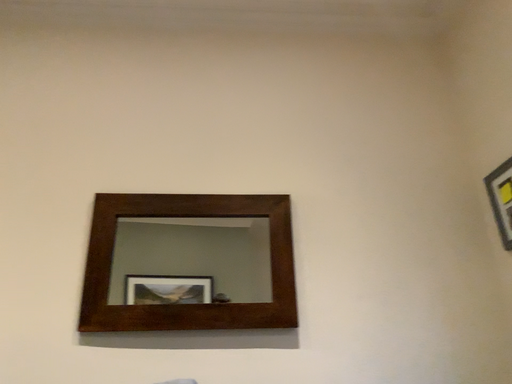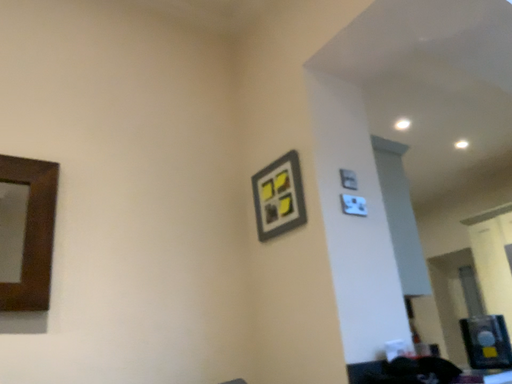
Question: How did the camera likely rotate when shooting the video?

Choices:
 (A) rotated right
 (B) rotated left

Answer: (A)